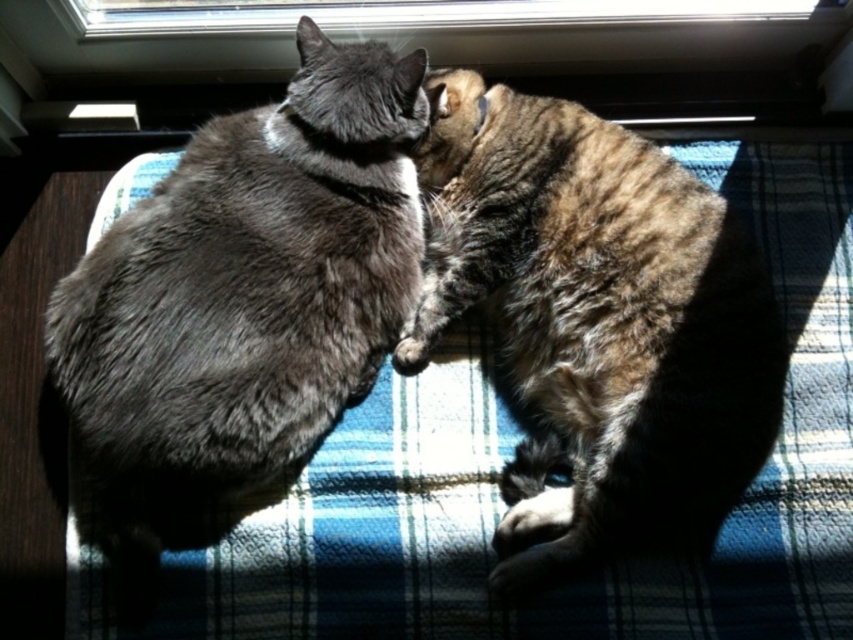
Question: Does gray fur cat at center have a smaller size compared to tabby fur cat at center?

Choices:
 (A) yes
 (B) no

Answer: (B)

Question: Which is farther from the tabby fur cat at center?

Choices:
 (A) gray fur cat at center
 (B) transparent glass window at upper center

Answer: (B)

Question: Estimate the real-world distances between objects in this image. Which object is closer to the tabby fur cat at center?

Choices:
 (A) gray fur cat at center
 (B) transparent glass window at upper center

Answer: (A)

Question: Based on their relative distances, which object is farther from the transparent glass window at upper center?

Choices:
 (A) gray fur cat at center
 (B) tabby fur cat at center

Answer: (B)

Question: Observing the image, what is the correct spatial positioning of tabby fur cat at center in reference to transparent glass window at upper center?

Choices:
 (A) right
 (B) left

Answer: (A)

Question: Where is tabby fur cat at center located in relation to transparent glass window at upper center in the image?

Choices:
 (A) above
 (B) below

Answer: (B)